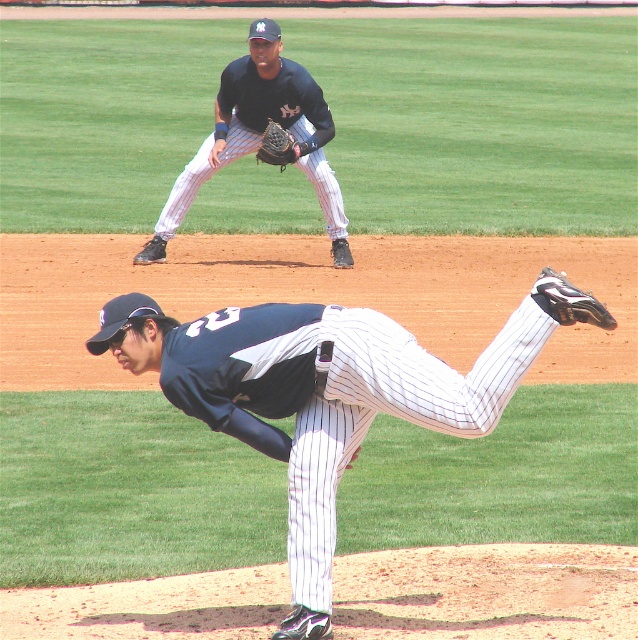
Question: Does white pinstriped pants at center appear on the left side of dark blue jersey at upper center?

Choices:
 (A) yes
 (B) no

Answer: (B)

Question: Is dark blue jersey at upper center positioned before brown leather glove at upper center?

Choices:
 (A) no
 (B) yes

Answer: (B)

Question: Observing the image, what is the correct spatial positioning of white pinstriped pants at center in reference to dark blue jersey at upper center?

Choices:
 (A) left
 (B) right

Answer: (B)

Question: Which point is farther to the camera?

Choices:
 (A) (237, 109)
 (B) (278, 129)
 (C) (454, 394)

Answer: (A)

Question: Which is farther from the brown leather glove at upper center?

Choices:
 (A) white pinstriped pants at center
 (B) dark blue jersey at upper center

Answer: (A)

Question: Which of these objects is positioned closest to the white pinstriped pants at center?

Choices:
 (A) brown leather glove at upper center
 (B) dark blue jersey at upper center

Answer: (A)